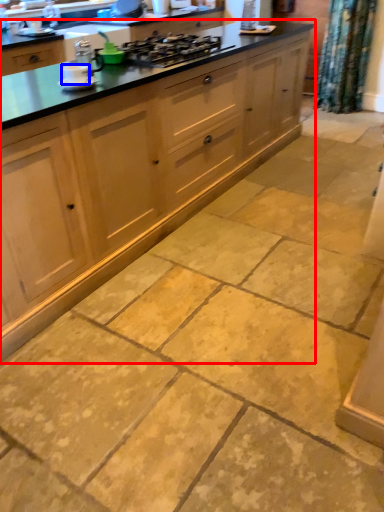
Question: Which object appears closest to the camera in this image, cabinetry (highlighted by a red box) or appliance (highlighted by a blue box)?

Choices:
 (A) cabinetry
 (B) appliance

Answer: (A)